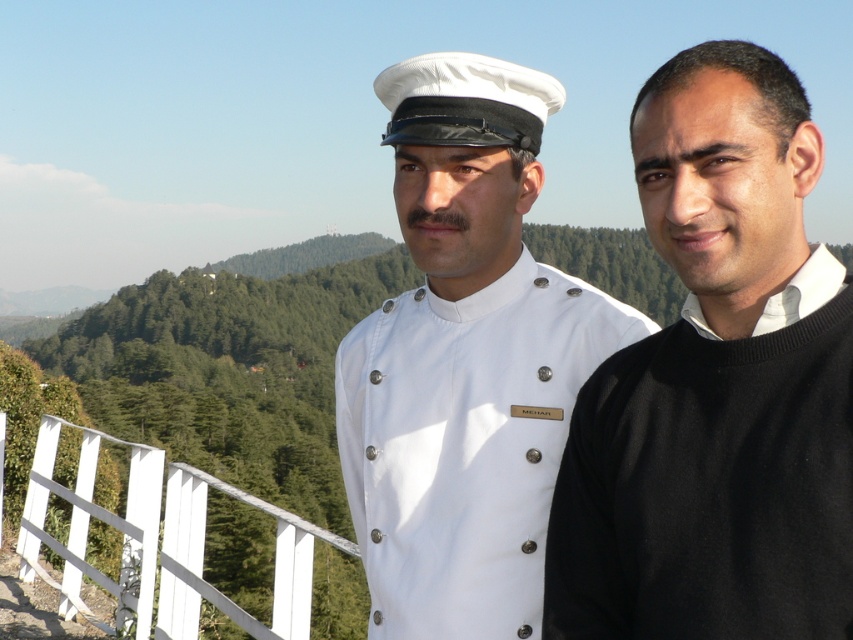
You are a photographer setting up for a group photo. You notice the white uniform at center and the white wooden fence at lower left in the frame. Which object should you adjust your camera angle to focus on if you want to capture the narrower object?

You should focus on the white uniform at center because its width is less than the white wooden fence at lower left, making it the narrower object.

You are a photographer setting up for an outdoor event. You need to ensure that the white matte uniform at center is clearly visible in the photo without being overshadowed by the white wooden fence at lower left. Based on their sizes, which object should you focus on to achieve this?

The white matte uniform at center has a smaller size compared to the white wooden fence at lower left. To ensure the uniform is clearly visible, focus on the white matte uniform at center since it is smaller and needs proper emphasis to stand out against the larger fence.